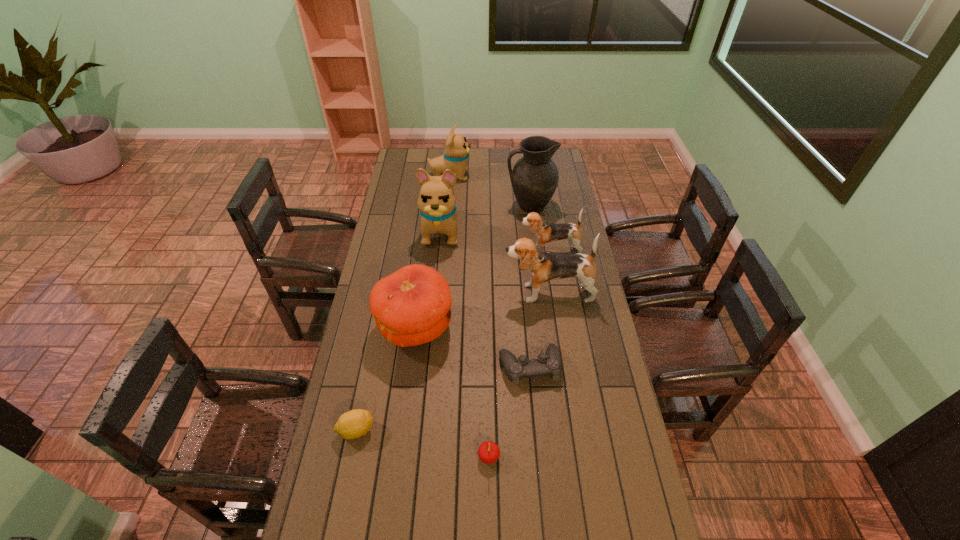
Locate an element on the screen. This screenshot has height=540, width=960. empty location between the bigger brown puppy and the pumpkin is located at coordinates (482, 310).

Find the location of a particular element. object that is the seventh nearest to the nearest puppy is located at coordinates (355, 423).

The height and width of the screenshot is (540, 960). What are the coordinates of `object that is the seventh nearest to the gray control` in the screenshot? It's located at (534, 178).

Where is `the third closest puppy to the bigger beige puppy`? This screenshot has height=540, width=960. the third closest puppy to the bigger beige puppy is located at coordinates (543, 266).

Image resolution: width=960 pixels, height=540 pixels. I want to click on puppy that is the third closest to the nearer beige puppy, so pos(543,266).

The image size is (960, 540). What are the coordinates of `vacant space that satisfies the following two spatial constraints: 1. on the face of the farthest object; 2. on the face of the nearer beige puppy` in the screenshot? It's located at (445, 230).

This screenshot has width=960, height=540. Find the location of `free space that satisfies the following two spatial constraints: 1. on the face of the nearer beige puppy; 2. on the right side of the fifth object from right to left`. free space that satisfies the following two spatial constraints: 1. on the face of the nearer beige puppy; 2. on the right side of the fifth object from right to left is located at coordinates (420, 456).

You are a GUI agent. You are given a task and a screenshot of the screen. Output one action in this format:
    pyautogui.click(x=<x>, y=<y>)
    Task: Click on the vacant space that satisfies the following two spatial constraints: 1. on the face of the bigger beige puppy; 2. on the left side of the gray control
    
    Given the screenshot: What is the action you would take?
    pyautogui.click(x=428, y=367)